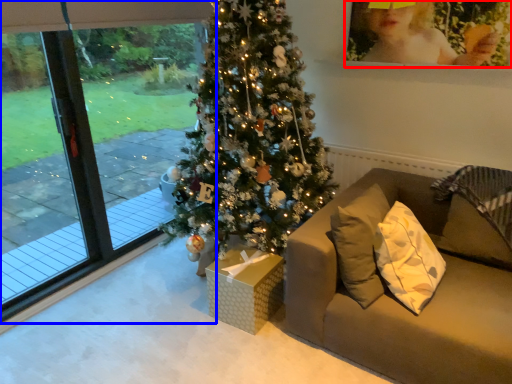
Question: Among these objects, which one is nearest to the camera, picture frame (highlighted by a red box) or window (highlighted by a blue box)?

Choices:
 (A) picture frame
 (B) window

Answer: (B)